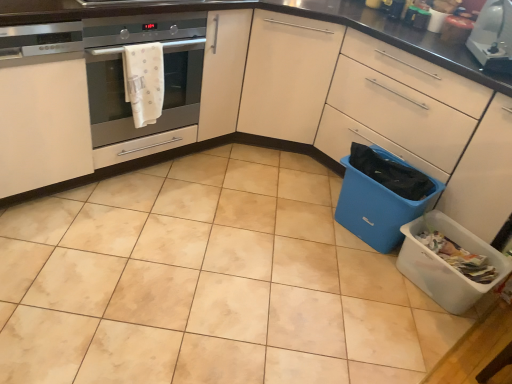
In order to click on free space in front of white plastic recycling bin at lower right, which is the 1th recycling bin in bottom-to-top order in this screenshot , I will do `click(443, 340)`.